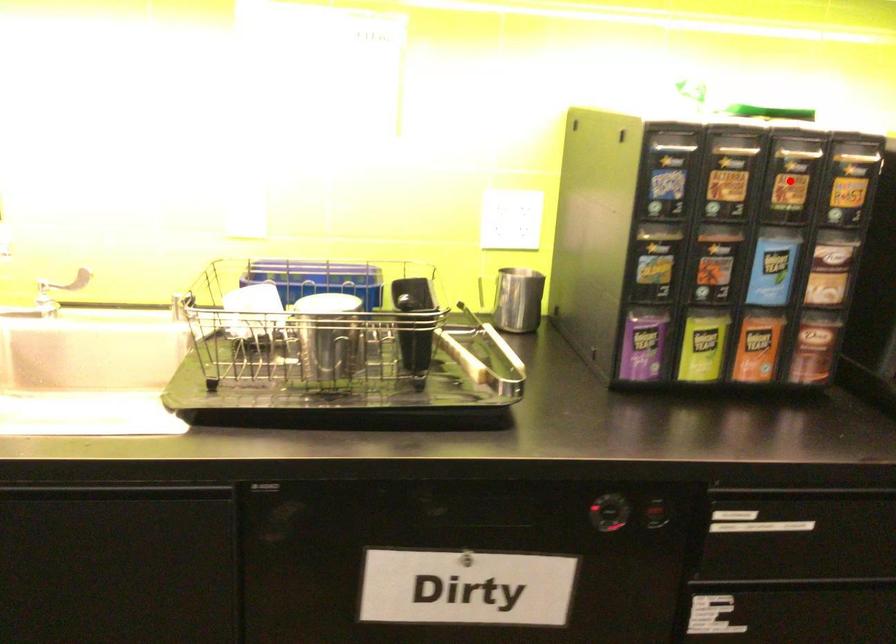
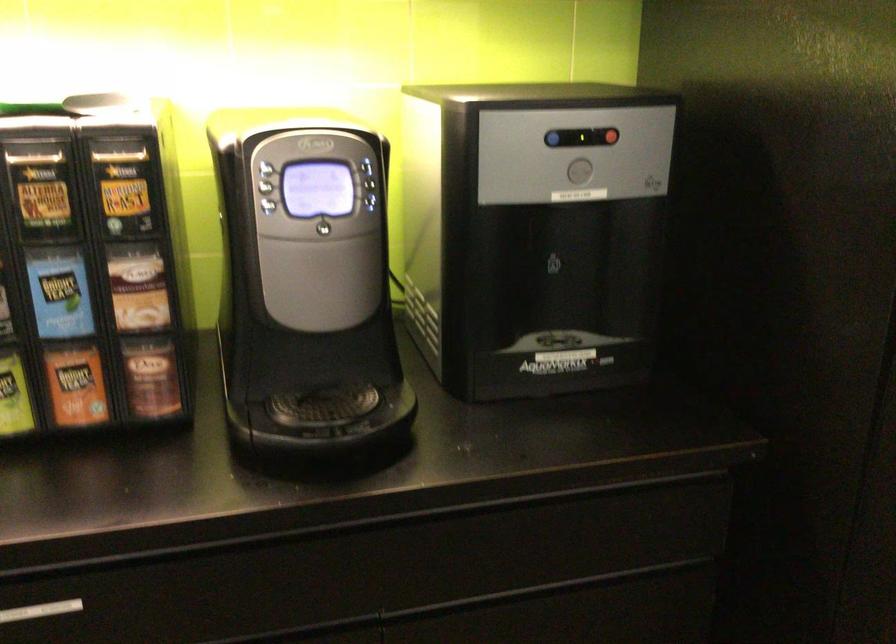
Question: I am providing you with two images of the same scene from different viewpoints. Image1 has a red point marked. In image2, the corresponding 3D location appears at what relative position? Reply with the corresponding letter.

Choices:
 (A) Closer
 (B) Farther

Answer: (A)